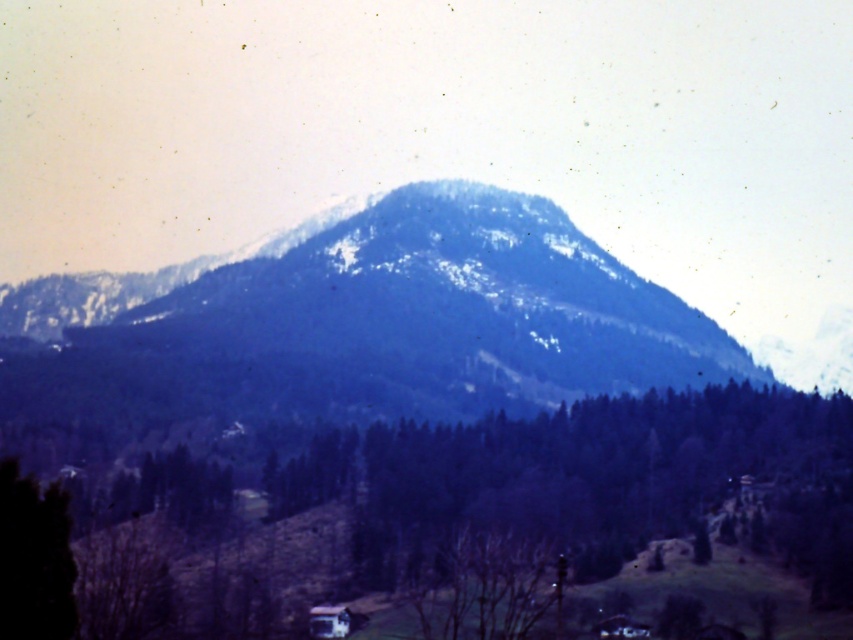
Which of these two, snowy forested mountain at center or green matte tree at lower left, stands taller?

With more height is snowy forested mountain at center.

In the scene shown: Can you confirm if snowy forested mountain at center is shorter than green matte tree at lower left?

No.

Which is behind, point (281, 392) or point (25, 509)?

Positioned behind is point (281, 392).

Find the location of a particular element. snowy forested mountain at center is located at coordinates (372, 324).

How distant is green matte tree at center from snowy forested mountain at center?

green matte tree at center is 79.05 meters from snowy forested mountain at center.

Which is in front, point (91, 602) or point (451, 285)?

Positioned in front is point (91, 602).

Does point (648, 518) lie in front of point (456, 268)?

That is True.

Find the location of a particular element. green matte tree at center is located at coordinates (474, 515).

Who is positioned more to the left, green matte tree at center or green matte tree at lower left?

From the viewer's perspective, green matte tree at lower left appears more on the left side.

Does point (358, 468) lie in front of point (47, 614)?

No, (358, 468) is behind (47, 614).

This screenshot has width=853, height=640. In order to click on green matte tree at center in this screenshot , I will do `click(474, 515)`.